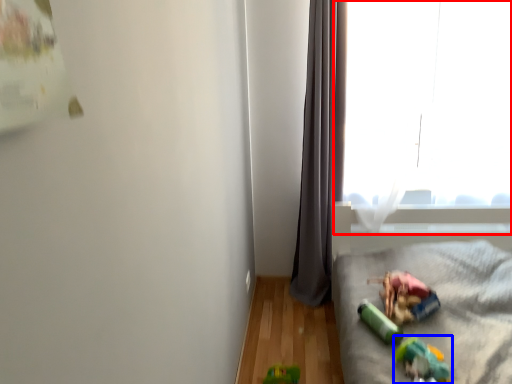
Question: Which object is further to the camera taking this photo, window (highlighted by a red box) or toy (highlighted by a blue box)?

Choices:
 (A) window
 (B) toy

Answer: (A)